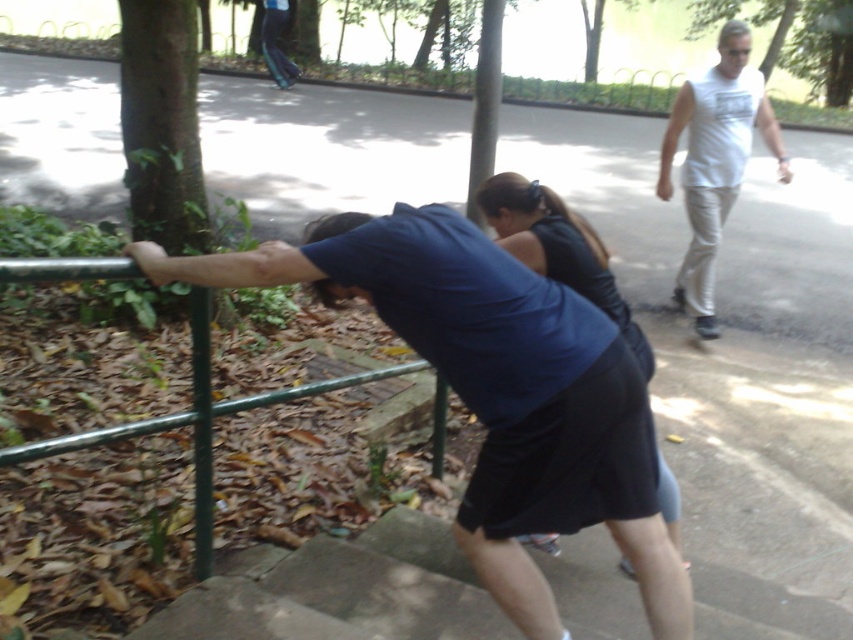
Who is positioned more to the right, white cotton tank top at upper right or green leafy tree at center?

Positioned to the right is white cotton tank top at upper right.

Is white cotton tank top at upper right wider than green leafy tree at center?

Yes.

Which is behind, point (715, 141) or point (490, 90)?

The point (715, 141) is more distant.

Find the location of `white cotton tank top at upper right`. white cotton tank top at upper right is located at coordinates (715, 161).

How much distance is there between black fabric dress at center and green leafy tree at center?

black fabric dress at center and green leafy tree at center are 2.39 meters apart.

Can you confirm if black fabric dress at center is shorter than green leafy tree at center?

No, black fabric dress at center is not shorter than green leafy tree at center.

Which is behind, point (555, 260) or point (490, 0)?

Point (490, 0)

In order to click on black fabric dress at center in this screenshot , I will do click(x=558, y=248).

Is green rough bark tree at upper left in front of green leafy tree at center?

Yes, green rough bark tree at upper left is closer to the viewer.

Measure the distance from green rough bark tree at upper left to green leafy tree at center.

A distance of 1.54 meters exists between green rough bark tree at upper left and green leafy tree at center.

Consider the image. Measure the distance between point (189, 65) and camera.

A distance of 4.07 meters exists between point (189, 65) and camera.

Locate an element on the screen. The image size is (853, 640). green rough bark tree at upper left is located at coordinates (161, 124).